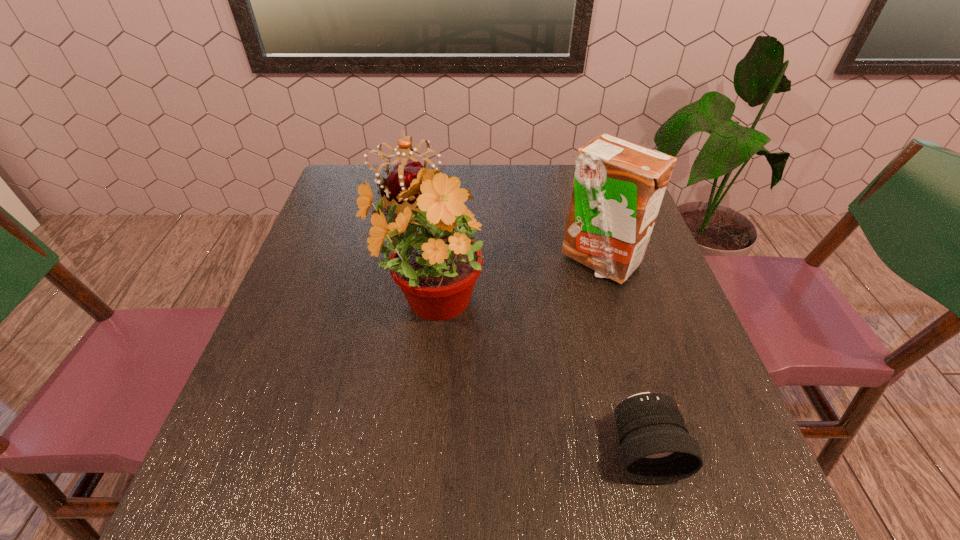
Locate an element on the screen. Image resolution: width=960 pixels, height=540 pixels. object that is positioned at the far edge is located at coordinates (403, 171).

Where is `object at the near edge`? object at the near edge is located at coordinates (656, 448).

I want to click on object that is at the left edge, so click(403, 171).

Where is `carton that is positioned at the right edge`? The height and width of the screenshot is (540, 960). carton that is positioned at the right edge is located at coordinates (618, 187).

Identify the location of telephoto lens that is at the right edge. Image resolution: width=960 pixels, height=540 pixels. (656, 448).

The width and height of the screenshot is (960, 540). I want to click on object that is at the far left corner, so click(403, 171).

The height and width of the screenshot is (540, 960). I want to click on object present at the near right corner, so click(x=656, y=448).

Locate an element on the screen. The image size is (960, 540). vacant space at the far edge of the desktop is located at coordinates (564, 172).

The image size is (960, 540). In the image, there is a desktop. In order to click on vacant region at the left edge in this screenshot , I will do `click(281, 401)`.

In the image, there is a desktop. In order to click on vacant region at the right edge in this screenshot , I will do `click(614, 295)`.